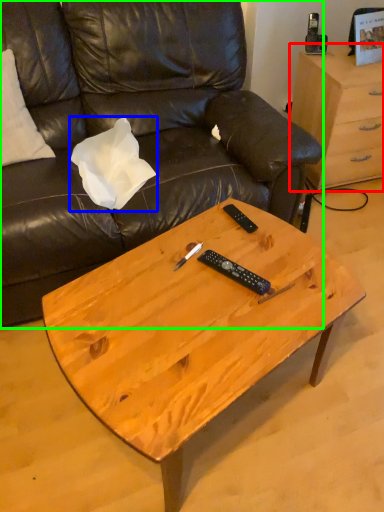
Question: Considering the real-world distances, which object is closest to desk (highlighted by a red box)? pillow (highlighted by a blue box) or studio couch (highlighted by a green box).

Choices:
 (A) pillow
 (B) studio couch

Answer: (B)